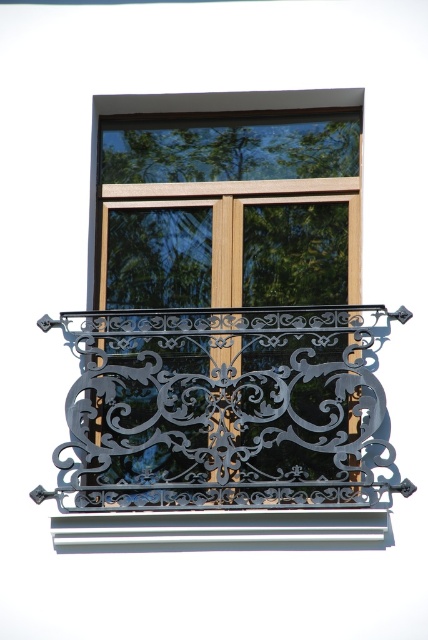
Question: Does wooden at center appear over metallic silver window sill at lower center?

Choices:
 (A) yes
 (B) no

Answer: (A)

Question: Which point is closer to the camera?

Choices:
 (A) (76, 541)
 (B) (290, 140)
 (C) (83, 515)

Answer: (C)

Question: Can you confirm if wooden at center is positioned to the left of black wrought iron balcony at center?

Choices:
 (A) no
 (B) yes

Answer: (A)

Question: Which object is positioned closest to the black wrought iron balcony at center?

Choices:
 (A) wooden at center
 (B) metallic silver window sill at lower center

Answer: (B)

Question: Where is wooden at center located in relation to black wrought iron balcony at center in the image?

Choices:
 (A) right
 (B) left

Answer: (A)

Question: Which object is positioned farthest from the metallic silver window sill at lower center?

Choices:
 (A) wooden at center
 (B) black wrought iron balcony at center

Answer: (A)